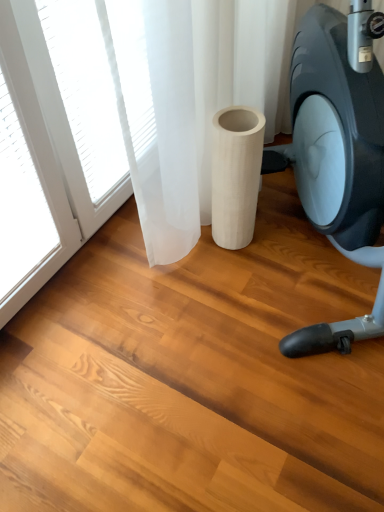
In order to click on vacant space to the left of white wood cylinder at center in this screenshot , I will do `click(190, 258)`.